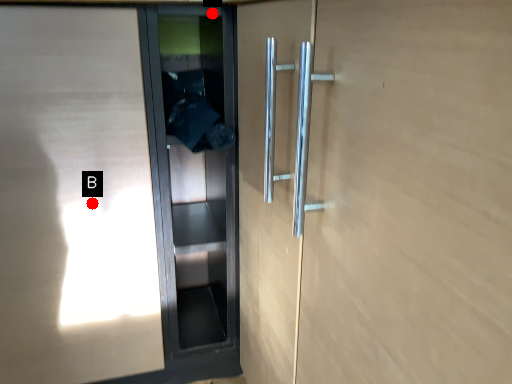
Question: Two points are circled on the image, labeled by A and B beside each circle. Which point is closer to the camera?

Choices:
 (A) A is closer
 (B) B is closer

Answer: (A)